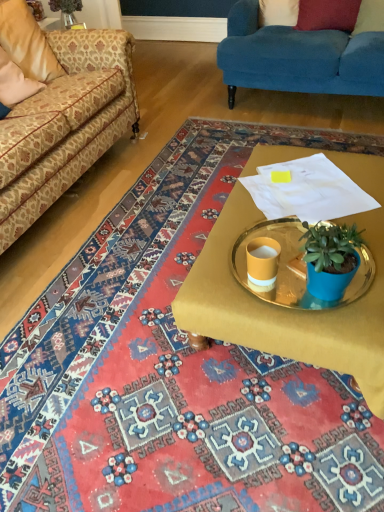
Where is `free space in front of matte yellow cup at center`? Image resolution: width=384 pixels, height=512 pixels. free space in front of matte yellow cup at center is located at coordinates (275, 314).